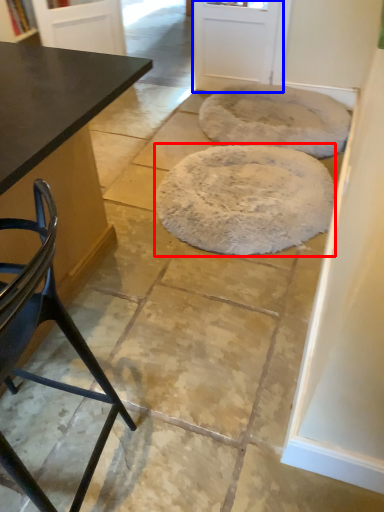
Question: Which object is further to the camera taking this photo, mat (highlighted by a red box) or screen door (highlighted by a blue box)?

Choices:
 (A) mat
 (B) screen door

Answer: (B)